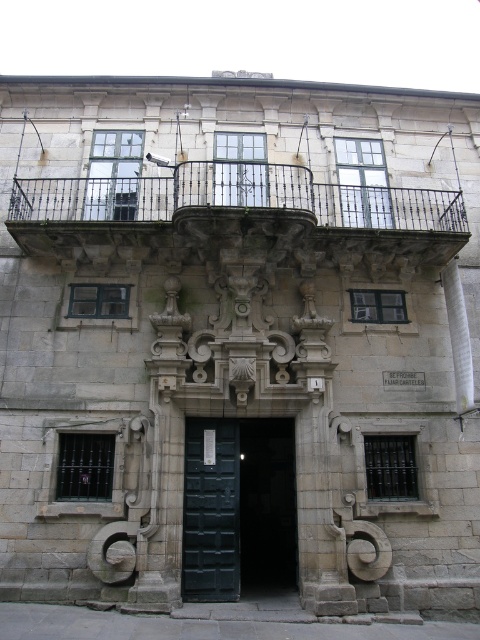
Question: Which object is closer to the camera taking this photo?

Choices:
 (A) dark green wooden door at center
 (B) green wooden door at center

Answer: (A)

Question: Which of these objects is positioned closest to the green wooden door at center?

Choices:
 (A) black wrought iron balcony at upper center
 (B) dark green wooden door at center

Answer: (B)

Question: Does black wrought iron balcony at upper center appear on the right side of dark green wooden door at center?

Choices:
 (A) yes
 (B) no

Answer: (A)

Question: Considering the relative positions of green wooden door at center and dark green wooden door at center in the image provided, where is green wooden door at center located with respect to dark green wooden door at center?

Choices:
 (A) below
 (B) above

Answer: (A)

Question: Which object is the farthest from the green wooden door at center?

Choices:
 (A) dark green wooden door at center
 (B) black wrought iron balcony at upper center

Answer: (B)

Question: Is black wrought iron balcony at upper center bigger than dark green wooden door at center?

Choices:
 (A) yes
 (B) no

Answer: (B)